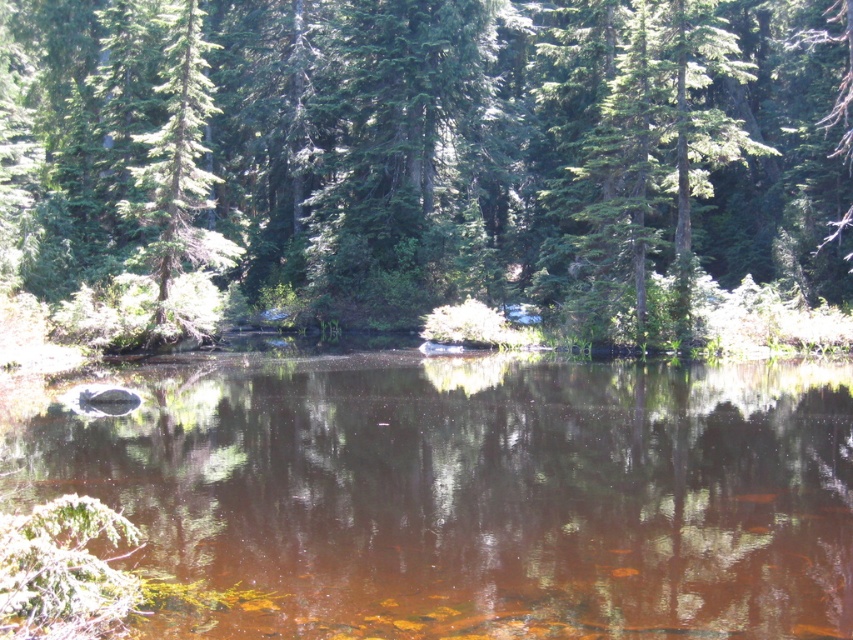
Question: From the image, what is the correct spatial relationship of green matte tree at center in relation to green matte tree at left?

Choices:
 (A) above
 (B) below

Answer: (A)

Question: Which object appears closest to the camera in this image?

Choices:
 (A) green matte tree at left
 (B) brown reflective water at center
 (C) green matte tree at center

Answer: (B)

Question: Does green matte tree at center appear on the right side of green matte tree at left?

Choices:
 (A) no
 (B) yes

Answer: (B)

Question: Among these points, which one is nearest to the camera?

Choices:
 (A) (811, 416)
 (B) (131, 116)
 (C) (151, 204)

Answer: (A)

Question: Which point is closer to the camera?

Choices:
 (A) brown reflective water at center
 (B) green matte tree at left

Answer: (A)

Question: Does green matte tree at center appear under green matte tree at left?

Choices:
 (A) yes
 (B) no

Answer: (B)